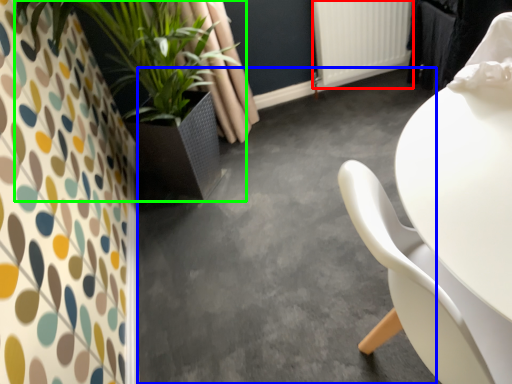
Question: Which object is positioned farthest from radiator (highlighted by a red box)? Select from concrete (highlighted by a blue box) and houseplant (highlighted by a green box).

Choices:
 (A) concrete
 (B) houseplant

Answer: (B)